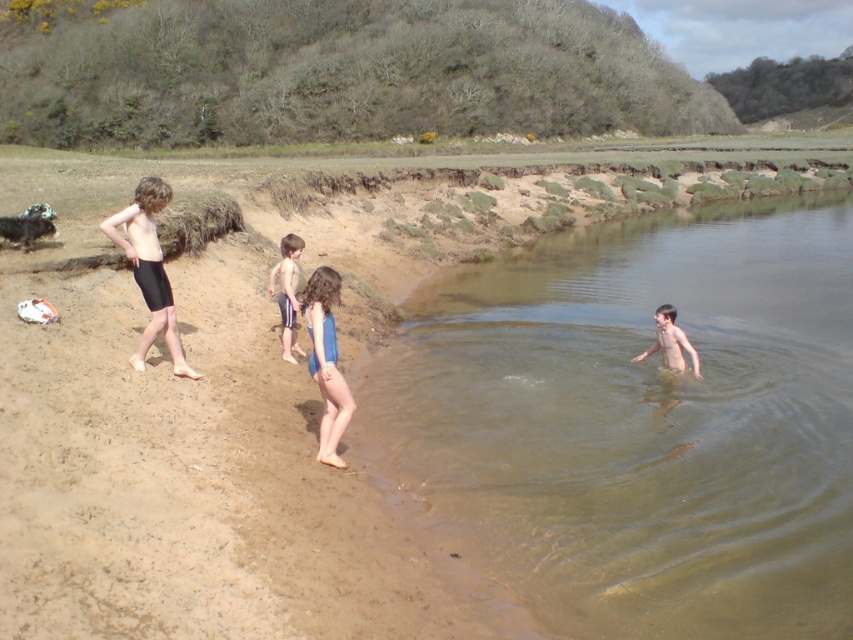
Does clear water at right appear on the left side of black matte shorts at left?

Incorrect, clear water at right is not on the left side of black matte shorts at left.

Can you confirm if clear water at right is thinner than black matte shorts at left?

No.

Does point (759, 502) come closer to viewer compared to point (149, 340)?

Yes, point (759, 502) is closer to viewer.

Image resolution: width=853 pixels, height=640 pixels. What are the coordinates of `clear water at right` in the screenshot? It's located at (642, 420).

Between black matte shorts at left and light brown skin at water right, which one has more height?

black matte shorts at left is taller.

Does point (172, 344) come farther from viewer compared to point (669, 353)?

No, (172, 344) is in front of (669, 353).

Identify the location of black matte shorts at left. (149, 269).

Between point (289, 348) and point (660, 314), which one is positioned in front?

Positioned in front is point (289, 348).

Who is shorter, blue fabric shorts at center or light brown skin at water right?

light brown skin at water right is shorter.

Does point (296, 248) come closer to viewer compared to point (669, 310)?

No, it is behind (669, 310).

At what (x,y) coordinates should I click in order to perform the action: click on blue fabric shorts at center. Please return your answer as a coordinate pair (x, y). Looking at the image, I should click on (287, 292).